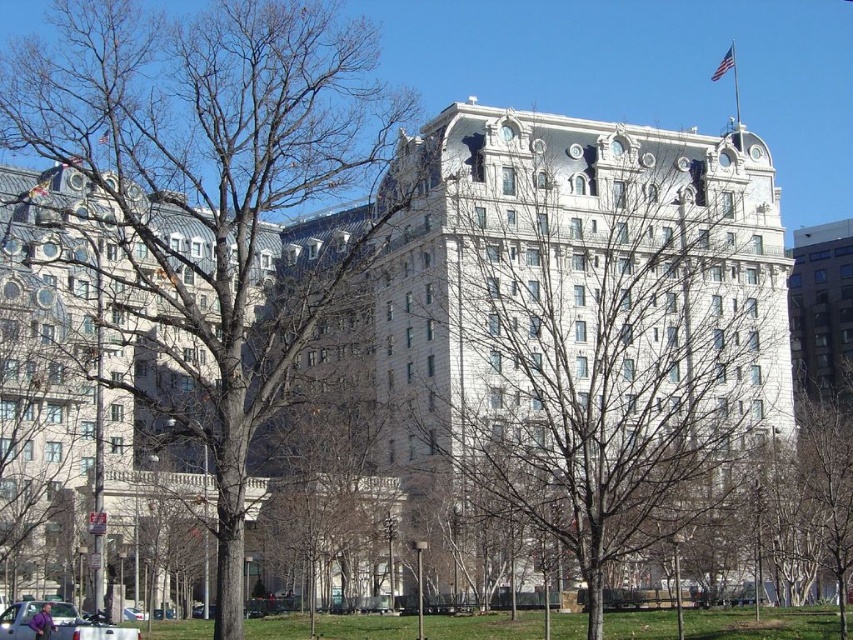
Is bare branches at center closer to the viewer compared to bare wood tree at center?

Yes, bare branches at center is in front of bare wood tree at center.

Does bare branches at center appear on the left side of bare wood tree at center?

No, bare branches at center is not to the left of bare wood tree at center.

Locate an element on the screen. The height and width of the screenshot is (640, 853). bare branches at center is located at coordinates [587, 321].

Where is `bare branches at center`? The height and width of the screenshot is (640, 853). bare branches at center is located at coordinates (587, 321).